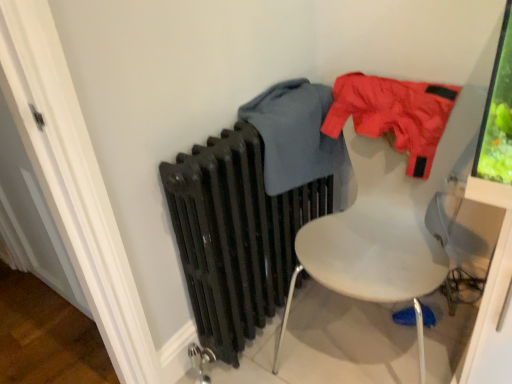
Question: Is matte gray sweater at center, which appears as the second clothing when viewed from the right, positioned with its back to white plastic chair at upper right?

Choices:
 (A) no
 (B) yes

Answer: (A)

Question: Does matte gray sweater at center, positioned as the 1th clothing in left-to-right order, turn towards white plastic chair at upper right?

Choices:
 (A) no
 (B) yes

Answer: (B)

Question: Is matte gray sweater at center, positioned as the 1th clothing in left-to-right order, shorter than white plastic chair at upper right?

Choices:
 (A) yes
 (B) no

Answer: (A)

Question: Considering the relative sizes of matte gray sweater at center, positioned as the 1th clothing in left-to-right order, and white plastic chair at upper right in the image provided, is matte gray sweater at center, positioned as the 1th clothing in left-to-right order, taller than white plastic chair at upper right?

Choices:
 (A) no
 (B) yes

Answer: (A)

Question: Can you confirm if matte gray sweater at center, positioned as the 1th clothing in left-to-right order, is bigger than white plastic chair at upper right?

Choices:
 (A) no
 (B) yes

Answer: (A)

Question: From a real-world perspective, is matte gray sweater at center, which appears as the second clothing when viewed from the right, on white plastic chair at upper right?

Choices:
 (A) yes
 (B) no

Answer: (A)

Question: Is the depth of white plastic chair at upper right greater than that of matte gray sweater at center, positioned as the 1th clothing in left-to-right order?

Choices:
 (A) yes
 (B) no

Answer: (B)

Question: Is white plastic chair at upper right looking in the opposite direction of matte gray sweater at center, which appears as the second clothing when viewed from the right?

Choices:
 (A) yes
 (B) no

Answer: (B)

Question: Can you confirm if white plastic chair at upper right is thinner than matte gray sweater at center, which appears as the second clothing when viewed from the right?

Choices:
 (A) no
 (B) yes

Answer: (A)

Question: Is white plastic chair at upper right smaller than matte gray sweater at center, which appears as the second clothing when viewed from the right?

Choices:
 (A) yes
 (B) no

Answer: (B)

Question: Considering the relative positions of white plastic chair at upper right and matte gray sweater at center, which appears as the second clothing when viewed from the right, in the image provided, is white plastic chair at upper right to the left of matte gray sweater at center, which appears as the second clothing when viewed from the right, from the viewer's perspective?

Choices:
 (A) no
 (B) yes

Answer: (A)

Question: Can you confirm if white plastic chair at upper right is taller than matte gray sweater at center, positioned as the 1th clothing in left-to-right order?

Choices:
 (A) yes
 (B) no

Answer: (A)

Question: Is matte nylon jacket at upper right, which is the second clothing from left to right, not near matte black radiator at center?

Choices:
 (A) yes
 (B) no

Answer: (B)